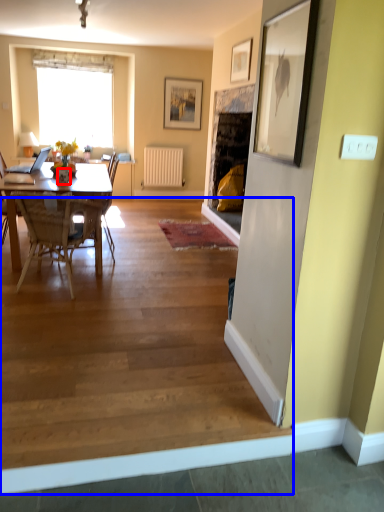
Question: Which object appears closest to the camera in this image, vase (highlighted by a red box) or stair (highlighted by a blue box)?

Choices:
 (A) vase
 (B) stair

Answer: (B)